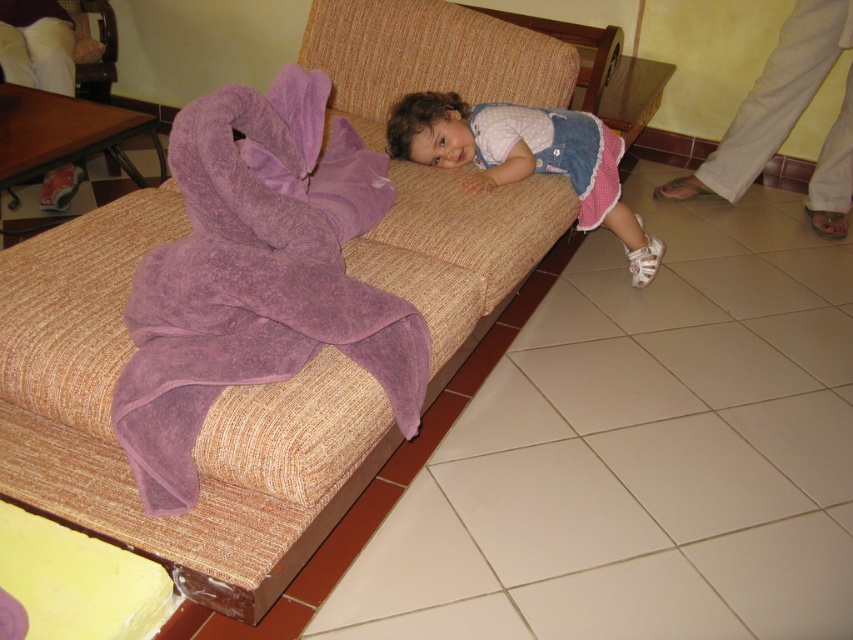
Is matte pink dress at center positioned at the back of purple terry cloth robe at upper right?

No, it is in front of purple terry cloth robe at upper right.

Who is more forward, (447, 116) or (473, 160)?

Positioned in front is point (447, 116).

Between point (639, 240) and point (566, 132), which one is positioned behind?

Point (639, 240)

Find the location of `matte pink dress at center`. matte pink dress at center is located at coordinates (525, 157).

Who is higher up, beige textured couch at center or purple terry cloth robe at upper right?

purple terry cloth robe at upper right

Can you confirm if beige textured couch at center is taller than purple terry cloth robe at upper right?

Yes.

Which is behind, point (303, 438) or point (502, 134)?

The point (502, 134) is more distant.

Identify the location of beige textured couch at center. This screenshot has width=853, height=640. (213, 480).

Which is more to the right, beige textured couch at center or matte pink dress at center?

matte pink dress at center

Which is in front, point (228, 576) or point (538, 136)?

Point (228, 576)

Image resolution: width=853 pixels, height=640 pixels. In order to click on beige textured couch at center in this screenshot , I will do `click(213, 480)`.